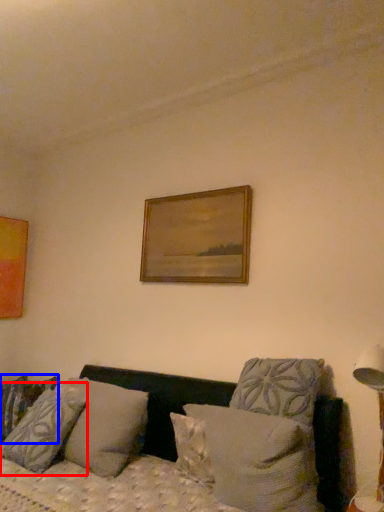
Question: Which object is closer to the camera taking this photo, pillow (highlighted by a red box) or pillow (highlighted by a blue box)?

Choices:
 (A) pillow
 (B) pillow

Answer: (A)